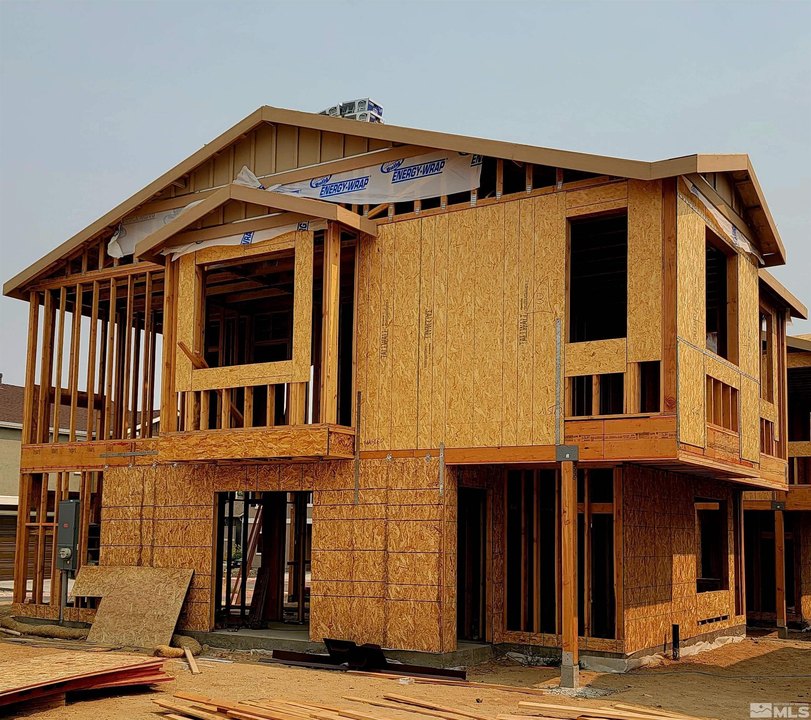
Find the location of a particular element. wood beams is located at coordinates (417, 706), (285, 706).